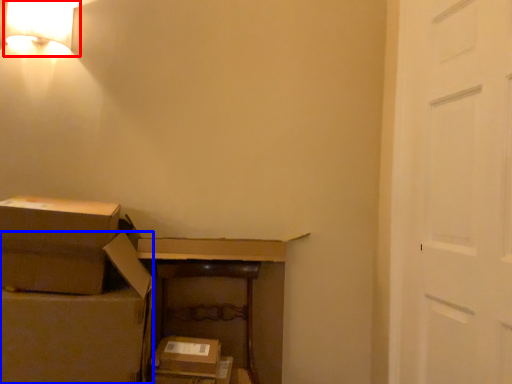
Question: Which of the following is the farthest to the observer, lamp (highlighted by a red box) or storage box (highlighted by a blue box)?

Choices:
 (A) lamp
 (B) storage box

Answer: (A)